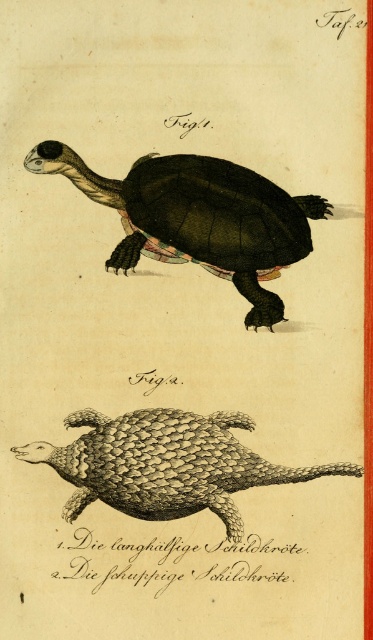
You are a naturalist examining the illustration. You need to determine which of the two animals, the matte black turtle at center or the shiny scaly pangolin at bottom center, requires a larger enclosure based on their size. Which one would you choose?

The matte black turtle at center is larger in size than the shiny scaly pangolin at bottom center, so it would require a larger enclosure.

You are an animal researcher looking at this historical illustration. You need to locate the shiny scaly pangolin at bottom center. Based on the arrangement, which direction should you look relative to the matte black turtle at center?

The shiny scaly pangolin at bottom center is to the right of the matte black turtle at center, so you should look to the right of the matte black turtle at center to find it.